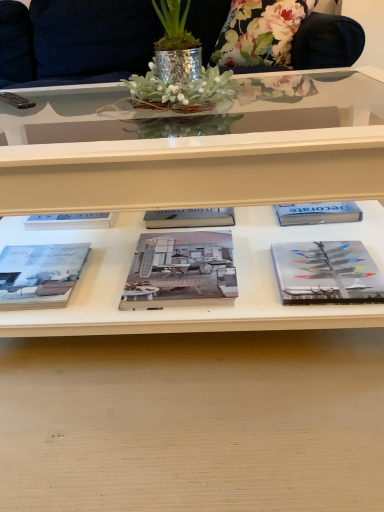
Question: Is gray matte book at right, acting as the 1th book starting from the right, facing away from matte gray book at lower left, marked as the third book in a right-to-left arrangement?

Choices:
 (A) no
 (B) yes

Answer: (A)

Question: Is gray matte book at right, which is the 3th book from left to right, further to the viewer compared to matte gray book at lower left, marked as the third book in a right-to-left arrangement?

Choices:
 (A) no
 (B) yes

Answer: (A)

Question: Is gray matte book at right, acting as the 1th book starting from the right, touching matte gray book at lower left, which is the 1th book in left-to-right order?

Choices:
 (A) no
 (B) yes

Answer: (A)

Question: Is gray matte book at right, which is the 3th book from left to right, at the right side of matte gray book at lower left, which is the 1th book in left-to-right order?

Choices:
 (A) no
 (B) yes

Answer: (B)

Question: Does gray matte book at right, acting as the 1th book starting from the right, contain matte gray book at lower left, marked as the third book in a right-to-left arrangement?

Choices:
 (A) yes
 (B) no

Answer: (B)

Question: From their relative heights in the image, would you say matte gray book at lower left, which is the 1th book in left-to-right order, is taller or shorter than gray matte book at right, which is the 3th book from left to right?

Choices:
 (A) short
 (B) tall

Answer: (B)

Question: In the image, is matte gray book at lower left, which is the 1th book in left-to-right order, on the left side or the right side of gray matte book at right, acting as the 1th book starting from the right?

Choices:
 (A) right
 (B) left

Answer: (B)

Question: Is matte gray book at lower left, which is the 1th book in left-to-right order, wider or thinner than gray matte book at right, which is the 3th book from left to right?

Choices:
 (A) thin
 (B) wide

Answer: (B)

Question: In terms of size, does matte gray book at lower left, which is the 1th book in left-to-right order, appear bigger or smaller than gray matte book at right, acting as the 1th book starting from the right?

Choices:
 (A) small
 (B) big

Answer: (B)

Question: From their relative heights in the image, would you say matte gray book at center, positioned as the second book in right-to-left order, is taller or shorter than black plastic remote control at upper left?

Choices:
 (A) tall
 (B) short

Answer: (B)

Question: Is matte gray book at center, which is counted as the second book, starting from the left, bigger or smaller than black plastic remote control at upper left?

Choices:
 (A) small
 (B) big

Answer: (B)

Question: From the image's perspective, is matte gray book at center, positioned as the second book in right-to-left order, above or below black plastic remote control at upper left?

Choices:
 (A) below
 (B) above

Answer: (A)

Question: Choose the correct answer: Is matte gray book at center, positioned as the second book in right-to-left order, inside black plastic remote control at upper left or outside it?

Choices:
 (A) inside
 (B) outside

Answer: (B)

Question: Considering the positions of shiny metallic pot at center and matte gray book at lower left, marked as the third book in a right-to-left arrangement, in the image, is shiny metallic pot at center taller or shorter than matte gray book at lower left, marked as the third book in a right-to-left arrangement,?

Choices:
 (A) short
 (B) tall

Answer: (B)

Question: In terms of size, does shiny metallic pot at center appear bigger or smaller than matte gray book at lower left, marked as the third book in a right-to-left arrangement?

Choices:
 (A) small
 (B) big

Answer: (B)